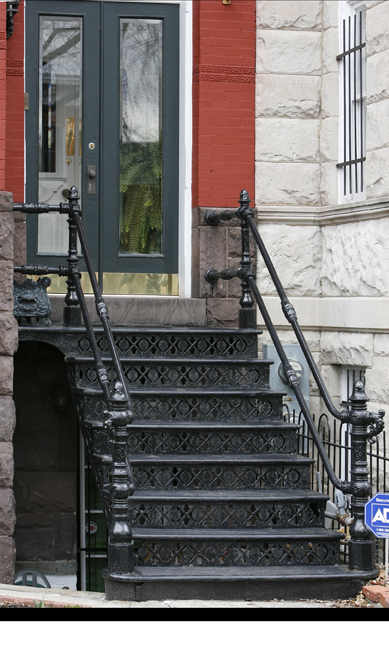
You are a GUI agent. You are given a task and a screenshot of the screen. Output one action in this format:
    pyautogui.click(x=<x>, y=<y>)
    Task: Click on the front door
    This screenshot has width=389, height=652.
    Given the screenshot: What is the action you would take?
    pyautogui.click(x=72, y=149)